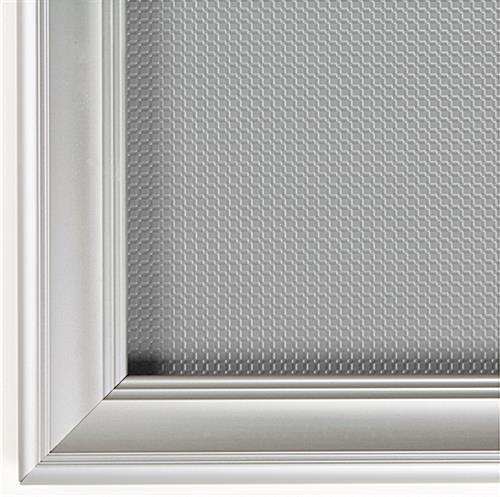
In order to click on picture frame in this screenshot , I will do `click(158, 432)`, `click(61, 135)`.